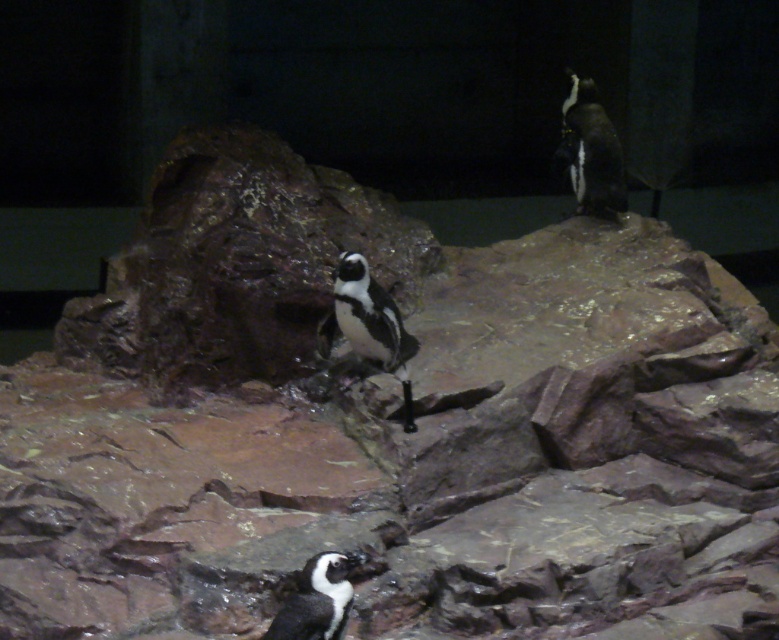
Who is taller, black matte penguin at center or black glossy penguin at lower center?

black matte penguin at center

Between point (376, 296) and point (305, 596), which one is positioned in front?

Point (305, 596) is in front.

Who is more distant from viewer, (374, 362) or (323, 596)?

The point (374, 362) is more distant.

Image resolution: width=779 pixels, height=640 pixels. Find the location of `black matte penguin at center`. black matte penguin at center is located at coordinates coord(368,324).

Who is positioned more to the left, black and white feathers at upper right or black glossy penguin at lower center?

black glossy penguin at lower center

Does black and white feathers at upper right lie in front of black glossy penguin at lower center?

No, it is behind black glossy penguin at lower center.

Does point (603, 172) come in front of point (270, 634)?

No, it is not.

Find the location of `black and white feathers at upper right`. black and white feathers at upper right is located at coordinates (591, 150).

Looking at this image, who is lower down, black matte penguin at center or black and white feathers at upper right?

Positioned lower is black matte penguin at center.

Is point (347, 292) behind point (589, 116)?

That is False.

Locate an element on the screen. The height and width of the screenshot is (640, 779). black matte penguin at center is located at coordinates (368, 324).